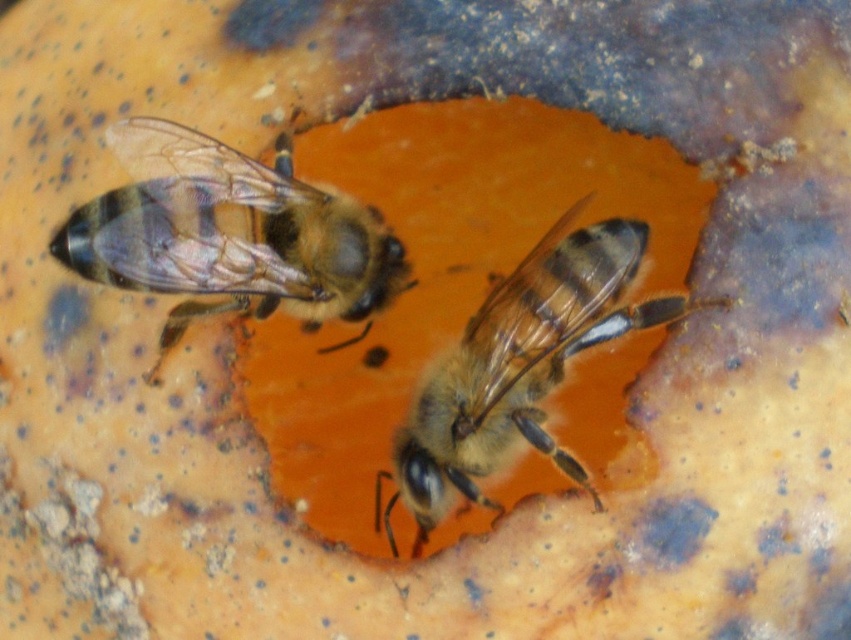
Does translucent brown bee at upper left have a larger size compared to translucent golden honeybee at center?

Actually, translucent brown bee at upper left might be smaller than translucent golden honeybee at center.

Measure the distance between point (295, 198) and camera.

Point (295, 198) is 37.89 inches away from camera.

Identify the location of translucent brown bee at upper left. This screenshot has width=851, height=640. (227, 234).

Locate an element on the screen. translucent brown bee at upper left is located at coordinates (227, 234).